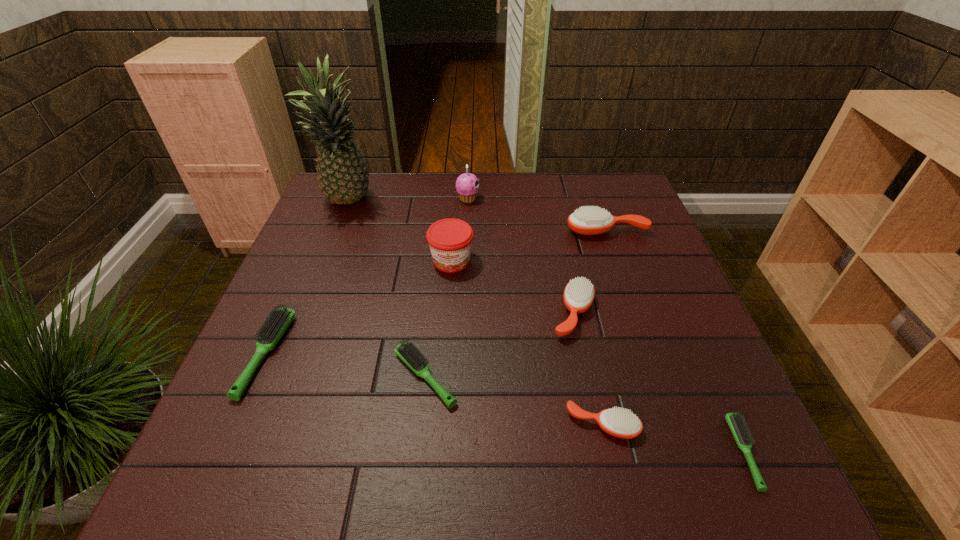
The height and width of the screenshot is (540, 960). What are the coordinates of `vacant space located 0.130m on the right of the fifth tallest object` in the screenshot? It's located at (654, 313).

Locate an element on the screen. This screenshot has width=960, height=540. free spot located 0.060m on the back of the biggest light hairbrush is located at coordinates pos(293,295).

You are a GUI agent. You are given a task and a screenshot of the screen. Output one action in this format:
    pyautogui.click(x=<x>, y=<y>)
    Task: Click on the free location located 0.130m on the right of the nearest orange hairbrush
    The width and height of the screenshot is (960, 540).
    Given the screenshot: What is the action you would take?
    pyautogui.click(x=708, y=424)

You are a GUI agent. You are given a task and a screenshot of the screen. Output one action in this format:
    pyautogui.click(x=<x>, y=<y>)
    Task: Click on the blank space located on the back of the fifth hairbrush from right to left
    The height and width of the screenshot is (540, 960).
    Given the screenshot: What is the action you would take?
    pyautogui.click(x=438, y=255)

Image resolution: width=960 pixels, height=540 pixels. What are the coordinates of `free location located 0.360m on the left of the nearest light hairbrush` in the screenshot? It's located at (531, 451).

Locate an element on the screen. pineapple that is at the far edge is located at coordinates (343, 177).

The height and width of the screenshot is (540, 960). What are the coordinates of `cupcake that is at the far edge` in the screenshot? It's located at (467, 185).

The image size is (960, 540). In order to click on object at the near edge in this screenshot , I will do `click(735, 421)`.

Locate an element on the screen. pineapple that is positioned at the left edge is located at coordinates (343, 177).

At what (x,y) coordinates should I click in order to perform the action: click on hairbrush that is at the left edge. Please return your answer as a coordinate pair (x, y). This screenshot has height=540, width=960. Looking at the image, I should click on (276, 324).